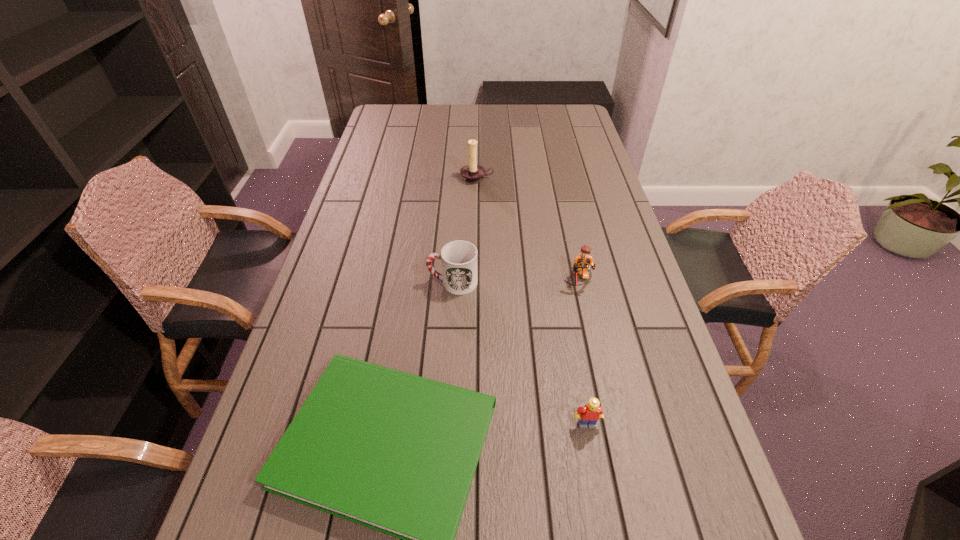
Identify the location of the farthest object. (472, 173).

In order to click on the tallest object in this screenshot , I will do `click(472, 173)`.

The height and width of the screenshot is (540, 960). I want to click on cup, so click(458, 258).

I want to click on the farther Lego, so click(x=583, y=262).

I want to click on the nearer Lego, so click(x=589, y=414).

This screenshot has height=540, width=960. Find the location of `vacant space situated on the wick of the farthest object`. vacant space situated on the wick of the farthest object is located at coordinates (476, 223).

I want to click on free space located on the handle side of the cup, so click(x=400, y=282).

Locate an element on the screen. The image size is (960, 540). free space located 0.230m on the handle side of the cup is located at coordinates (x=347, y=282).

Find the location of a particular element. vacant position located on the handle side of the cup is located at coordinates (411, 282).

At what (x,y) coordinates should I click in order to perform the action: click on free space located 0.230m holding a crossbow in the hands of the farther Lego. Please return your answer as a coordinate pair (x, y). This screenshot has height=540, width=960. Looking at the image, I should click on (597, 364).